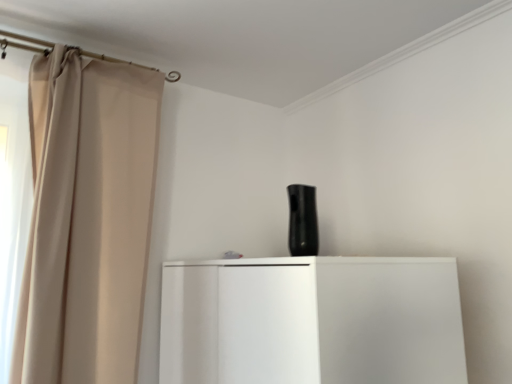
Where is `black matte speaker at center`? This screenshot has height=384, width=512. black matte speaker at center is located at coordinates (303, 220).

The height and width of the screenshot is (384, 512). What do you see at coordinates (303, 220) in the screenshot?
I see `black matte speaker at center` at bounding box center [303, 220].

Identify the location of beige fabric curtain at left. The image size is (512, 384). (87, 219).

Describe the element at coordinates (87, 219) in the screenshot. I see `beige fabric curtain at left` at that location.

Locate an element on the screen. The width and height of the screenshot is (512, 384). black matte speaker at center is located at coordinates (303, 220).

In the image, is beige fabric curtain at left on the left side or the right side of black matte speaker at center?

beige fabric curtain at left is positioned on black matte speaker at center's left side.

Who is more distant, beige fabric curtain at left or black matte speaker at center?

black matte speaker at center is further away from the camera.

Is point (129, 107) positioned before point (289, 220)?

Yes, point (129, 107) is in front of point (289, 220).

From the image's perspective, is beige fabric curtain at left above or below black matte speaker at center?

From the image's perspective, beige fabric curtain at left appears below black matte speaker at center.

From a real-world perspective, which is physically below, beige fabric curtain at left or black matte speaker at center?

From a 3D spatial view, black matte speaker at center is below.

Looking at their sizes, would you say beige fabric curtain at left is wider or thinner than black matte speaker at center?

In the image, beige fabric curtain at left appears to be wider than black matte speaker at center.

Looking at this image, is beige fabric curtain at left shorter than black matte speaker at center?

No.

Can you confirm if beige fabric curtain at left is smaller than black matte speaker at center?

No, beige fabric curtain at left is not smaller than black matte speaker at center.

Choose the correct answer: Is beige fabric curtain at left inside black matte speaker at center or outside it?

beige fabric curtain at left is outside black matte speaker at center.

Is the surface of beige fabric curtain at left in direct contact with black matte speaker at center?

No, beige fabric curtain at left is not touching black matte speaker at center.

Looking at this image, is beige fabric curtain at left aimed at black matte speaker at center?

No.

How different are the orientations of beige fabric curtain at left and black matte speaker at center in degrees?

There is a 90-degree angle between the facing directions of beige fabric curtain at left and black matte speaker at center.

Image resolution: width=512 pixels, height=384 pixels. I want to click on appliance behind the beige fabric curtain at left, so click(303, 220).

In the scene shown: Does black matte speaker at center appear on the left side of beige fabric curtain at left?

No.

Is the depth of black matte speaker at center less than that of beige fabric curtain at left?

No, black matte speaker at center is behind beige fabric curtain at left.

Which is further, (313, 255) or (31, 271)?

Positioned behind is point (31, 271).

From the image's perspective, which is above, black matte speaker at center or beige fabric curtain at left?

black matte speaker at center.

From a real-world perspective, between black matte speaker at center and beige fabric curtain at left, who is vertically lower?

In real-world perspective, black matte speaker at center is lower.

Considering the sizes of objects black matte speaker at center and beige fabric curtain at left in the image provided, who is wider, black matte speaker at center or beige fabric curtain at left?

With larger width is beige fabric curtain at left.

Considering the relative sizes of black matte speaker at center and beige fabric curtain at left in the image provided, is black matte speaker at center shorter than beige fabric curtain at left?

Yes.

In the scene shown: Can you confirm if black matte speaker at center is bigger than beige fabric curtain at left?

Actually, black matte speaker at center might be smaller than beige fabric curtain at left.

Is black matte speaker at center completely or partially outside of beige fabric curtain at left?

Absolutely, black matte speaker at center is external to beige fabric curtain at left.

Is black matte speaker at center not near beige fabric curtain at left?

black matte speaker at center is actually quite close to beige fabric curtain at left.

Could you tell me if black matte speaker at center is facing beige fabric curtain at left?

No, black matte speaker at center is not turned towards beige fabric curtain at left.

The image size is (512, 384). There is a black matte speaker at center. In order to click on curtain above it (from a real-world perspective) in this screenshot , I will do `click(87, 219)`.

You are a GUI agent. You are given a task and a screenshot of the screen. Output one action in this format:
    pyautogui.click(x=<x>, y=<y>)
    Task: Click on the curtain above the black matte speaker at center (from a real-world perspective)
    The height and width of the screenshot is (384, 512).
    Given the screenshot: What is the action you would take?
    pyautogui.click(x=87, y=219)

The image size is (512, 384). Identify the location of appliance on the right of the beige fabric curtain at left. (303, 220).